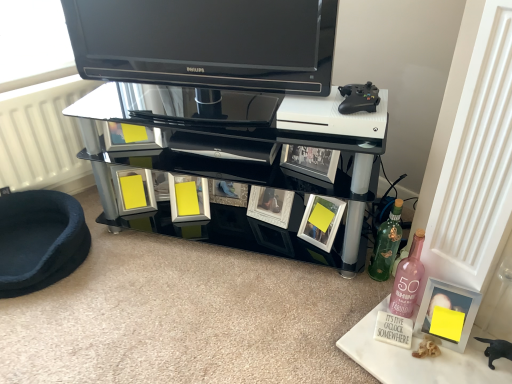
Question: Should I look upward or downward to see pink glass bottle at lower right, the second bottle when ordered from back to front?

Choices:
 (A) down
 (B) up

Answer: (A)

Question: Considering the relative sizes of dark blue plush pet bed at lower left and black glossy television at upper center in the image provided, is dark blue plush pet bed at lower left bigger than black glossy television at upper center?

Choices:
 (A) yes
 (B) no

Answer: (B)

Question: Is dark blue plush pet bed at lower left to the left of black glossy television at upper center from the viewer's perspective?

Choices:
 (A) yes
 (B) no

Answer: (A)

Question: From the image's perspective, does dark blue plush pet bed at lower left appear lower than black glossy television at upper center?

Choices:
 (A) no
 (B) yes

Answer: (B)

Question: Is dark blue plush pet bed at lower left beside black glossy television at upper center?

Choices:
 (A) yes
 (B) no

Answer: (B)

Question: Considering the relative sizes of dark blue plush pet bed at lower left and black glossy television at upper center in the image provided, is dark blue plush pet bed at lower left thinner than black glossy television at upper center?

Choices:
 (A) no
 (B) yes

Answer: (A)

Question: Would you say dark blue plush pet bed at lower left is outside black glossy television at upper center?

Choices:
 (A) yes
 (B) no

Answer: (A)

Question: From a real-world perspective, is dark blue plush pet bed at lower left over pink glass bottle at lower right, which appears as the first bottle when viewed from the front?

Choices:
 (A) yes
 (B) no

Answer: (B)

Question: Could pink glass bottle at lower right, the second bottle when ordered from back to front, be considered to be inside dark blue plush pet bed at lower left?

Choices:
 (A) yes
 (B) no

Answer: (B)

Question: Is dark blue plush pet bed at lower left facing towards pink glass bottle at lower right, the second bottle when ordered from back to front?

Choices:
 (A) no
 (B) yes

Answer: (A)

Question: Does dark blue plush pet bed at lower left have a greater width compared to pink glass bottle at lower right, which appears as the first bottle when viewed from the front?

Choices:
 (A) no
 (B) yes

Answer: (B)

Question: Does dark blue plush pet bed at lower left come in front of pink glass bottle at lower right, the second bottle when ordered from back to front?

Choices:
 (A) yes
 (B) no

Answer: (B)

Question: Is dark blue plush pet bed at lower left shorter than pink glass bottle at lower right, which appears as the first bottle when viewed from the front?

Choices:
 (A) yes
 (B) no

Answer: (A)

Question: Can you confirm if white glossy picture frame at lower center, marked as the second picture frame in a front-to-back arrangement, is taller than pink glass bottle at lower right, the second bottle when ordered from back to front?

Choices:
 (A) yes
 (B) no

Answer: (B)